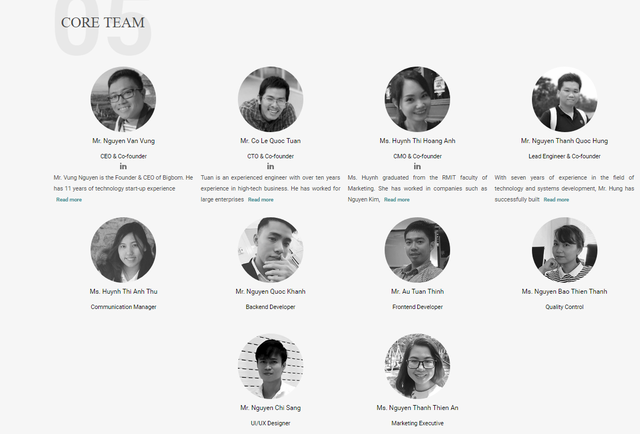
This screenshot has height=434, width=640. I want to click on picture, so click(114, 101), click(128, 256), click(272, 378), click(429, 379), click(420, 258), click(566, 270), click(564, 105), click(416, 109), click(272, 93), click(269, 252).